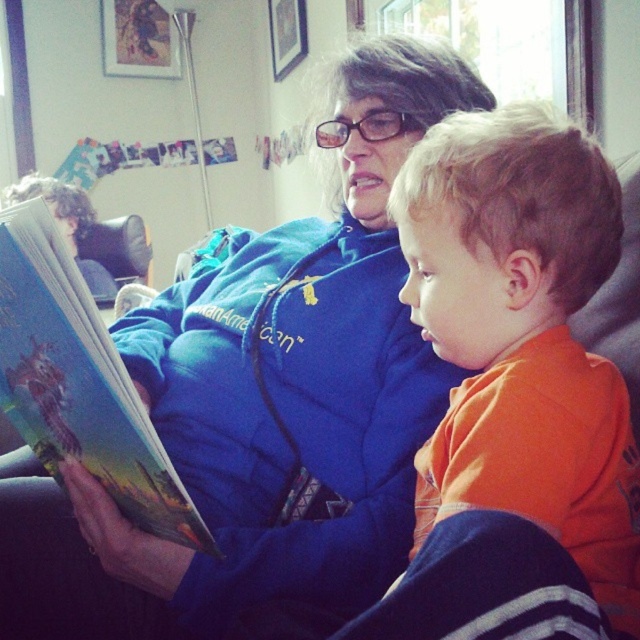
Question: Can you confirm if blue fleece jacket at center is positioned to the right of orange cotton shirt at center?

Choices:
 (A) no
 (B) yes

Answer: (A)

Question: Which point appears farthest from the camera in this image?

Choices:
 (A) (604, 568)
 (B) (45, 314)
 (C) (337, 321)

Answer: (C)

Question: Which object appears closest to the camera in this image?

Choices:
 (A) orange cotton shirt at center
 (B) hardcover book at left

Answer: (A)

Question: Estimate the real-world distances between objects in this image. Which object is farther from the blue fleece jacket at center?

Choices:
 (A) hardcover book at left
 (B) orange cotton shirt at center

Answer: (B)

Question: Considering the relative positions of blue fleece jacket at center and hardcover book at left in the image provided, where is blue fleece jacket at center located with respect to hardcover book at left?

Choices:
 (A) left
 (B) right

Answer: (A)

Question: Does blue fleece jacket at center appear on the left side of orange cotton shirt at center?

Choices:
 (A) yes
 (B) no

Answer: (A)